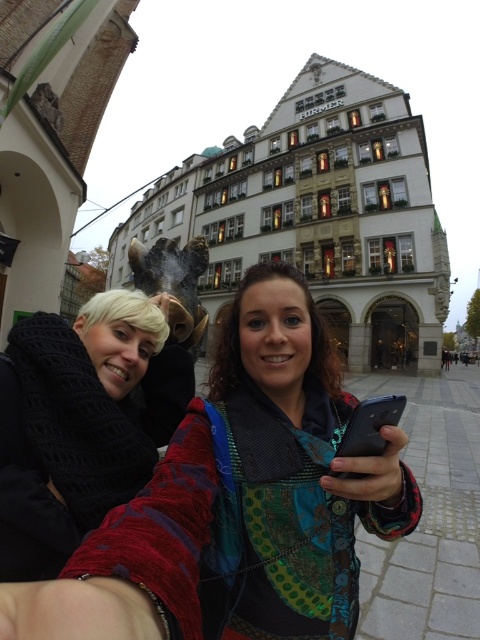
Question: Does black knitted scarf at left have a greater width compared to black glossy smartphone at lower center?

Choices:
 (A) yes
 (B) no

Answer: (A)

Question: Does black knitted scarf at left appear on the left side of black glossy smartphone at lower center?

Choices:
 (A) no
 (B) yes

Answer: (B)

Question: Which object appears closest to the camera in this image?

Choices:
 (A) black glossy smartphone at lower center
 (B) black knitted scarf at left

Answer: (B)

Question: Which of the following is the closest to the observer?

Choices:
 (A) black knitted scarf at left
 (B) black glossy smartphone at lower center

Answer: (A)

Question: Is black knitted scarf at left smaller than black glossy smartphone at lower center?

Choices:
 (A) yes
 (B) no

Answer: (B)